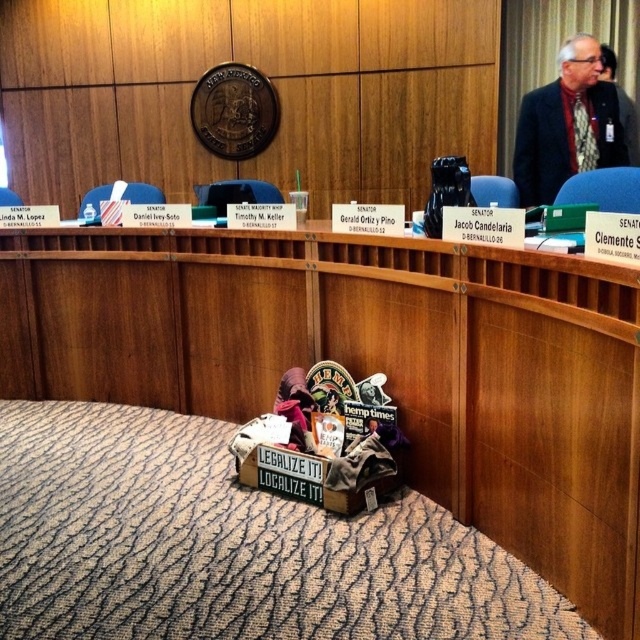
You are an assistant in the New Mexico Senate chamber. You need to store the black fabric jacket at upper right and the wooden box at center. Which item requires a larger storage space?

The wooden box at center requires a larger storage space because it has a larger size compared to the black fabric jacket at upper right.

You are standing in the New Mexico Senate chamber and want to place a small plant between the two points marked as point (476, 305) and point (624, 109). Which point should you stand closer to when placing the plant to ensure it is centered between them?

You should stand closer to point (476, 305) because it is closer to the viewer than point (624, 109). Placing the plant closer to the nearer point will center it between both points along the line of sight.

You are a photographer who needs to take a closeup shot of the wooden box at center. You have a camera that requires you to be at least 1.5 meters away from the subject to avoid distortion. Can you take the photo without moving the camera?

The wooden box at center and camera are 1.45 meters apart from each other, which is less than the required 1.5 meters. Therefore, you cannot take the photo without moving the camera to maintain the distance requirement.